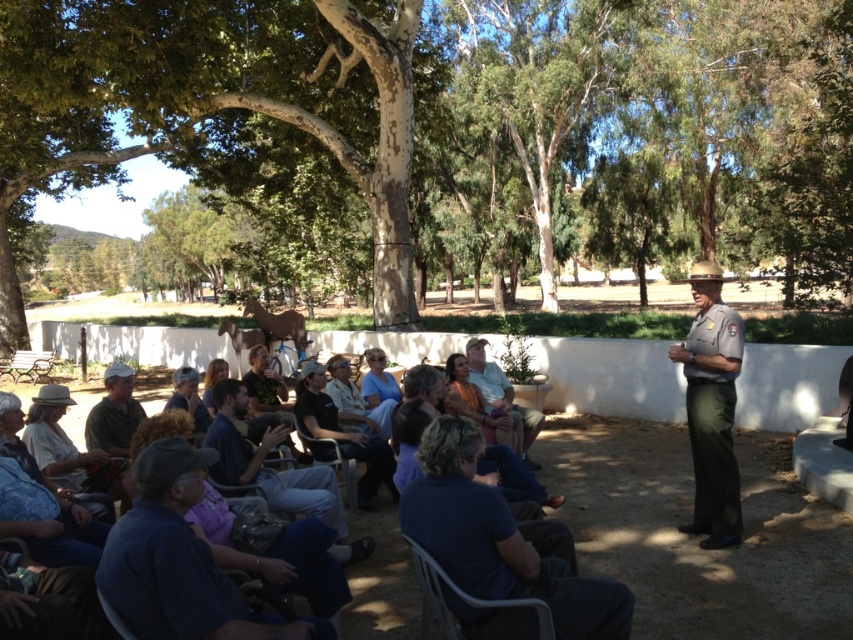
Is the position of dark gray uniform at center less distant than that of metallic gray chair at lower center?

No, it is behind metallic gray chair at lower center.

Between point (312, 376) and point (439, 604), which one is positioned in front?

Positioned in front is point (439, 604).

Is point (372, 444) positioned behind point (538, 630)?

Yes.

Where is `dark gray uniform at center`? The image size is (853, 640). dark gray uniform at center is located at coordinates (343, 433).

Who is more forward, (x=369, y=589) or (x=111, y=385)?

Positioned in front is point (x=369, y=589).

Does point (387, 577) lie behind point (128, 433)?

That is False.

Locate an element on the screen. The height and width of the screenshot is (640, 853). blue fabric chairs at center is located at coordinates (381, 577).

Is smooth bark tree at center taller than metallic gray chair at lower center?

Yes, smooth bark tree at center is taller than metallic gray chair at lower center.

Is point (206, 266) more distant than point (444, 582)?

Yes, it is behind point (444, 582).

Does point (538, 156) come in front of point (457, 625)?

No, it is behind (457, 625).

At what (x,y) coordinates should I click in order to perform the action: click on smooth bark tree at center. Please return your answer as a coordinate pair (x, y). Image resolution: width=853 pixels, height=640 pixels. Looking at the image, I should click on (442, 138).